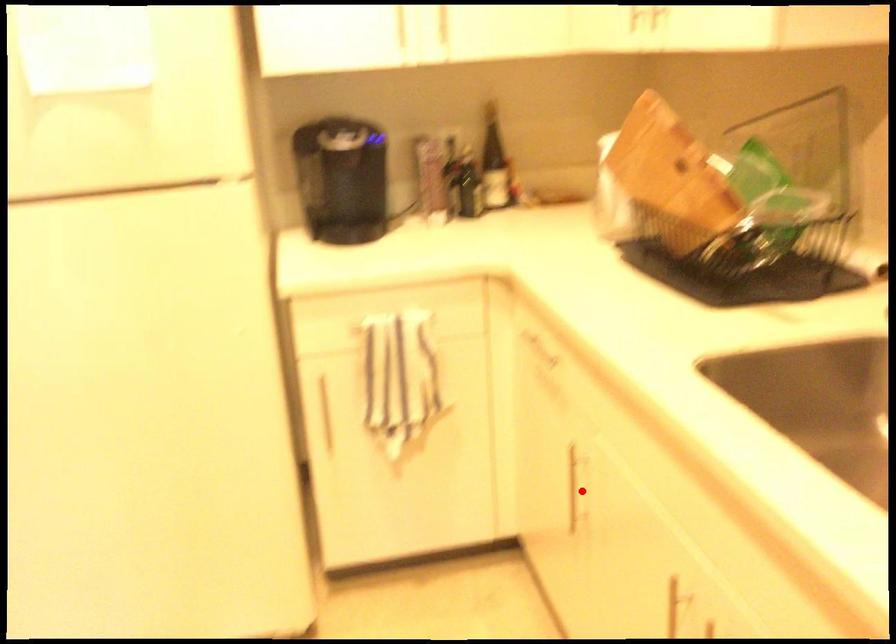
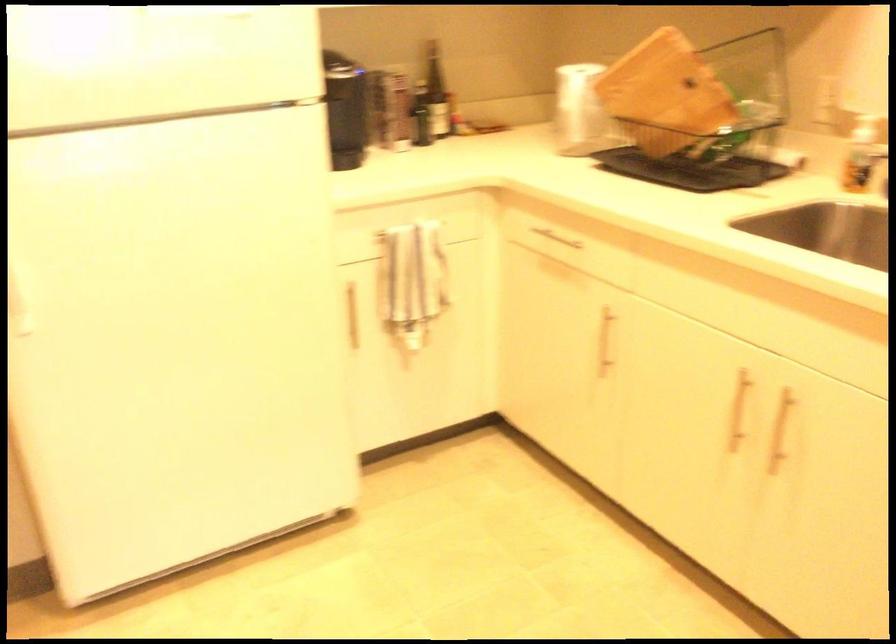
Where in the second image is the point corresponding to the highlighted location from the first image?

(605, 341)